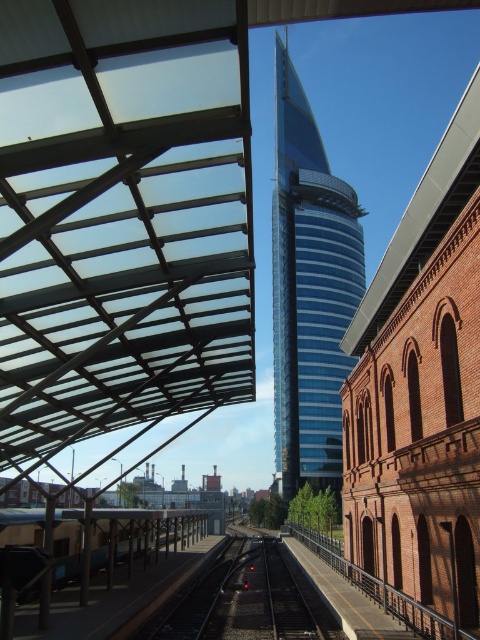
Question: Observing the image, what is the correct spatial positioning of blue glass tower at center in reference to black asphalt train track at center?

Choices:
 (A) below
 (B) above

Answer: (B)

Question: Among these objects, which one is farthest from the camera?

Choices:
 (A) metallic gray train at lower left
 (B) blue glass tower at center

Answer: (B)

Question: Where is black asphalt train track at center located in relation to metallic gray train at lower left in the image?

Choices:
 (A) right
 (B) left

Answer: (A)

Question: Which object is positioned farthest from the metallic gray train at lower left?

Choices:
 (A) blue glass tower at center
 (B) black asphalt train track at center

Answer: (A)

Question: Does blue glass tower at center appear on the left side of black asphalt train track at center?

Choices:
 (A) yes
 (B) no

Answer: (B)

Question: Which of the following is the closest to the observer?

Choices:
 (A) metallic gray train at lower left
 (B) black asphalt train track at center
 (C) blue glass tower at center

Answer: (A)